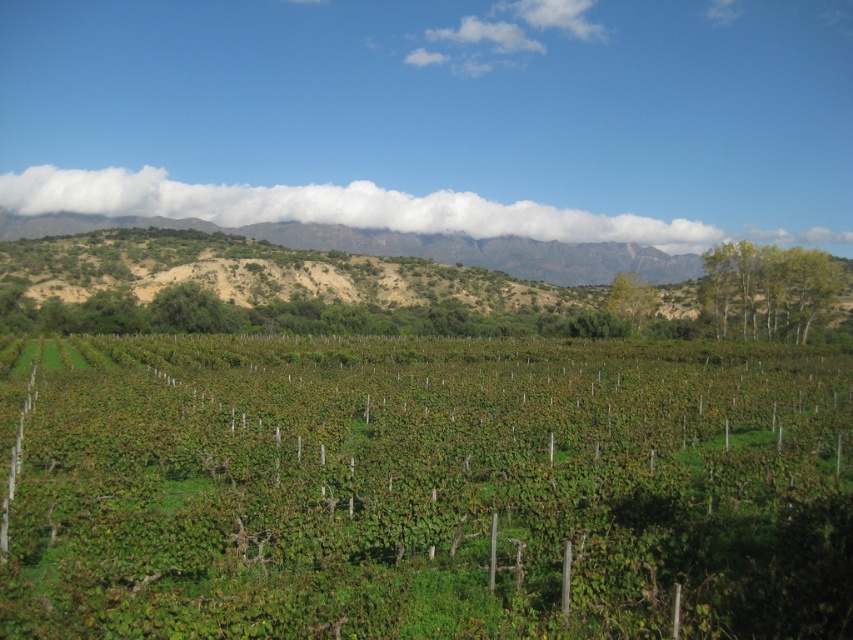
This screenshot has height=640, width=853. Find the location of `green leafy vineyard at center`. green leafy vineyard at center is located at coordinates (425, 488).

Does point (722, 291) come farther from viewer compared to point (624, 305)?

No, it is not.

Is green leafy tree at upper right below green leafy tree at center?

Actually, green leafy tree at upper right is above green leafy tree at center.

Is point (793, 259) in front of point (625, 314)?

Yes, point (793, 259) is in front of point (625, 314).

Where is `green leafy tree at upper right`? Image resolution: width=853 pixels, height=640 pixels. green leafy tree at upper right is located at coordinates (764, 289).

Who is higher up, white fluffy cloud at upper center or green leafy tree at center?

Positioned higher is white fluffy cloud at upper center.

Measure the distance from white fluffy cloud at upper center to green leafy tree at center.

A distance of 140.16 meters exists between white fluffy cloud at upper center and green leafy tree at center.

Is point (463, 220) more distant than point (639, 305)?

That is True.

Where is `white fluffy cloud at upper center`? The height and width of the screenshot is (640, 853). white fluffy cloud at upper center is located at coordinates (334, 208).